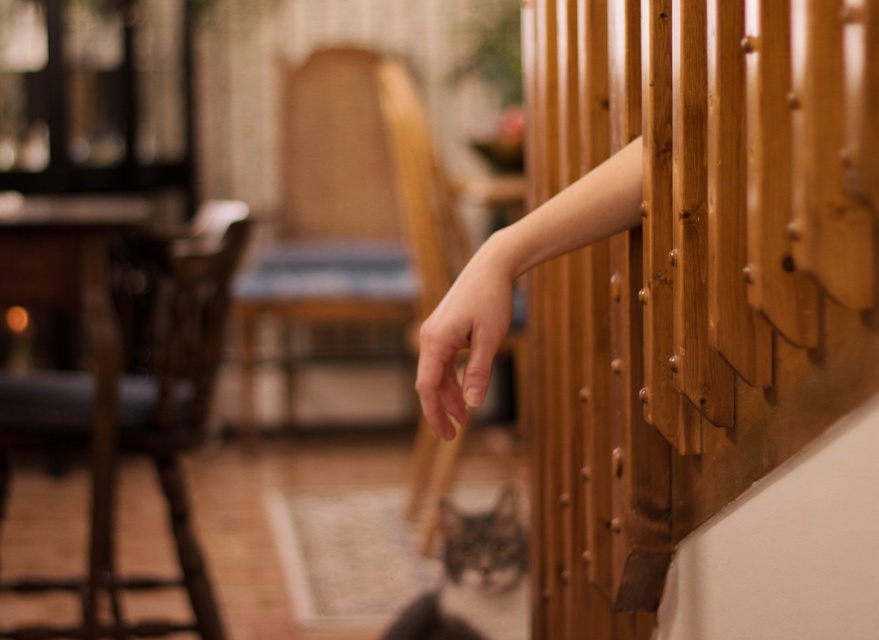
Question: Does wooden at right have a larger size compared to wooden chair at left?

Choices:
 (A) yes
 (B) no

Answer: (B)

Question: Is wooden at right wider than pale skin hand at center?

Choices:
 (A) no
 (B) yes

Answer: (B)

Question: Which object appears farthest from the camera in this image?

Choices:
 (A) wooden at right
 (B) pale skin hand at center
 (C) wooden chair at left

Answer: (C)

Question: Which of the following is the closest to the observer?

Choices:
 (A) (452, 307)
 (B) (478, 312)
 (C) (781, 134)

Answer: (C)

Question: In this image, where is wooden chair at left located relative to pale skin hand at center?

Choices:
 (A) left
 (B) right

Answer: (A)

Question: Which of the following is the farthest from the observer?

Choices:
 (A) (447, 372)
 (B) (469, 397)
 (C) (580, 29)
 (D) (17, 401)

Answer: (D)